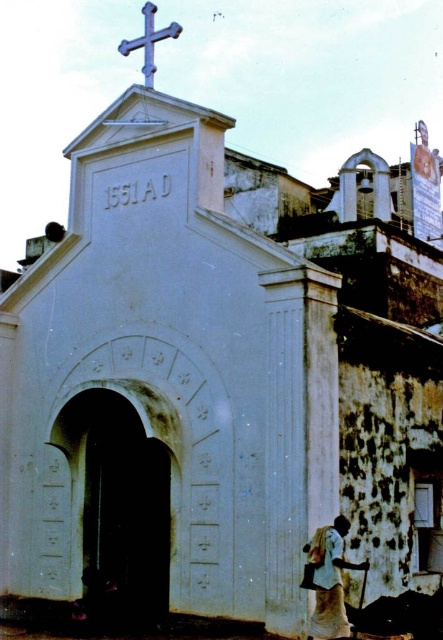
This screenshot has width=443, height=640. Identify the location of white cloth at lower right. coord(329,579).

Does white cloth at lower right lie behind blue metallic cross at upper center?

No, white cloth at lower right is closer to the viewer.

Is point (318, 637) positioned behind point (159, 36)?

No.

The width and height of the screenshot is (443, 640). What are the coordinates of `white cloth at lower right` in the screenshot? It's located at (329, 579).